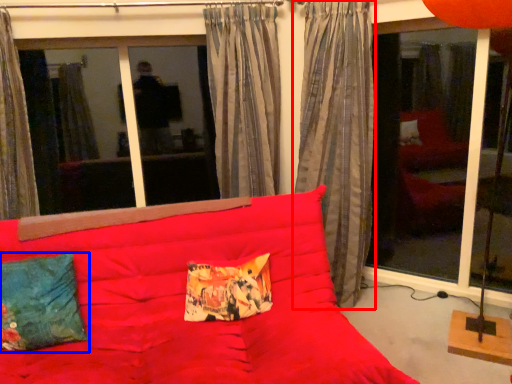
Question: Among these objects, which one is nearest to the camera, curtain (highlighted by a red box) or pillow (highlighted by a blue box)?

Choices:
 (A) curtain
 (B) pillow

Answer: (B)